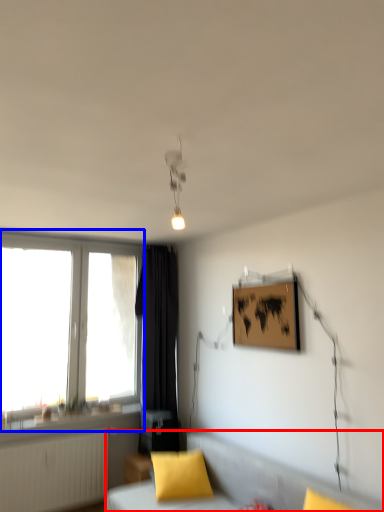
Question: Among these objects, which one is farthest to the camera, furniture (highlighted by a red box) or window (highlighted by a blue box)?

Choices:
 (A) furniture
 (B) window

Answer: (B)